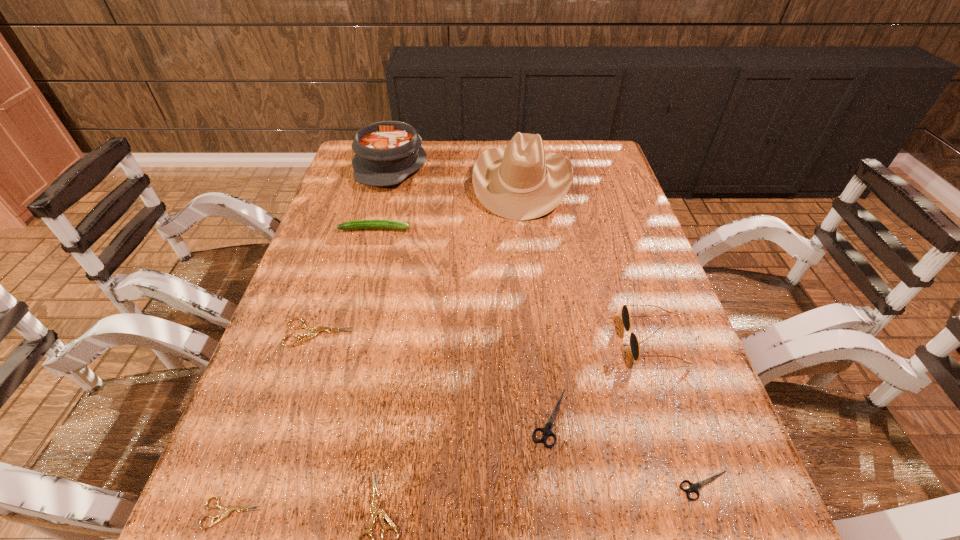
I want to click on free space located on the front-facing side of the third tallest object, so click(x=593, y=339).

Find the location of a particular element. This screenshot has width=960, height=540. vacant space situated on the front-facing side of the fourth tallest object is located at coordinates (540, 229).

Identify the location of vacant space situated 0.210m on the back of the sixth farthest object. The image size is (960, 540). (537, 310).

Image resolution: width=960 pixels, height=540 pixels. In order to click on vacant space situated 0.090m on the back of the farthest shears in this screenshot , I will do point(333,290).

At what (x,y) coordinates should I click in order to perform the action: click on free point located 0.170m on the left of the nearer black shears. Please return your answer as a coordinate pair (x, y). The image size is (960, 540). Looking at the image, I should click on (578, 485).

I want to click on vacant space located 0.190m on the right of the shortest shears, so click(376, 513).

Find the location of `cowboy hat that is at the far edge`. cowboy hat that is at the far edge is located at coordinates (521, 182).

I want to click on casserole that is at the far edge, so click(386, 153).

Image resolution: width=960 pixels, height=540 pixels. I want to click on object at the near edge, so click(229, 509).

Identify the location of casserole located at the left edge. The width and height of the screenshot is (960, 540). (386, 153).